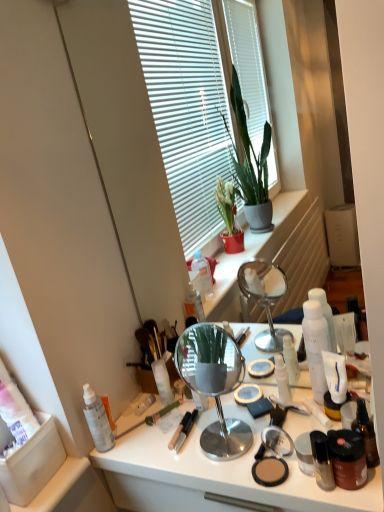
The height and width of the screenshot is (512, 384). What are the coordinates of `free spot to the right of transparent plastic spray bottle at left, the 7th toiletry in the right-to-left sequence` in the screenshot? It's located at (164, 441).